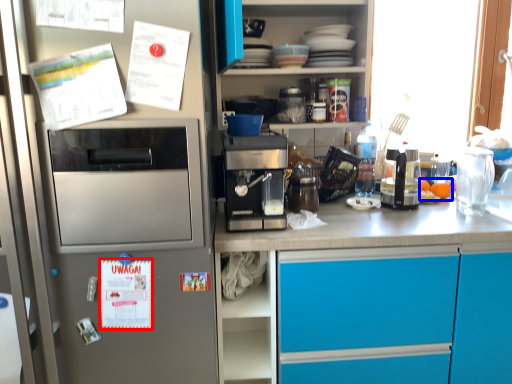
Question: Which object is closer to the camera taking this photo, postcard (highlighted by a red box) or food (highlighted by a blue box)?

Choices:
 (A) postcard
 (B) food

Answer: (A)